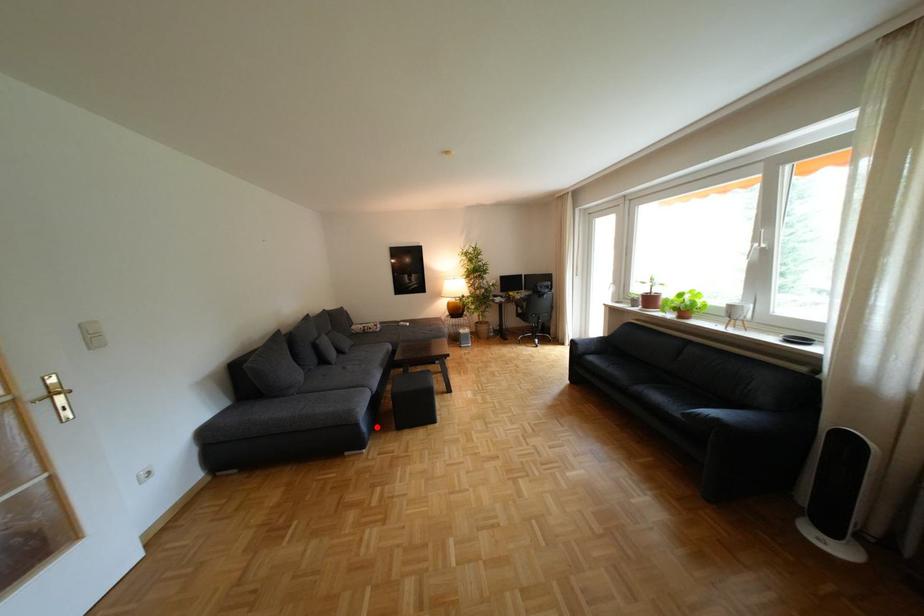
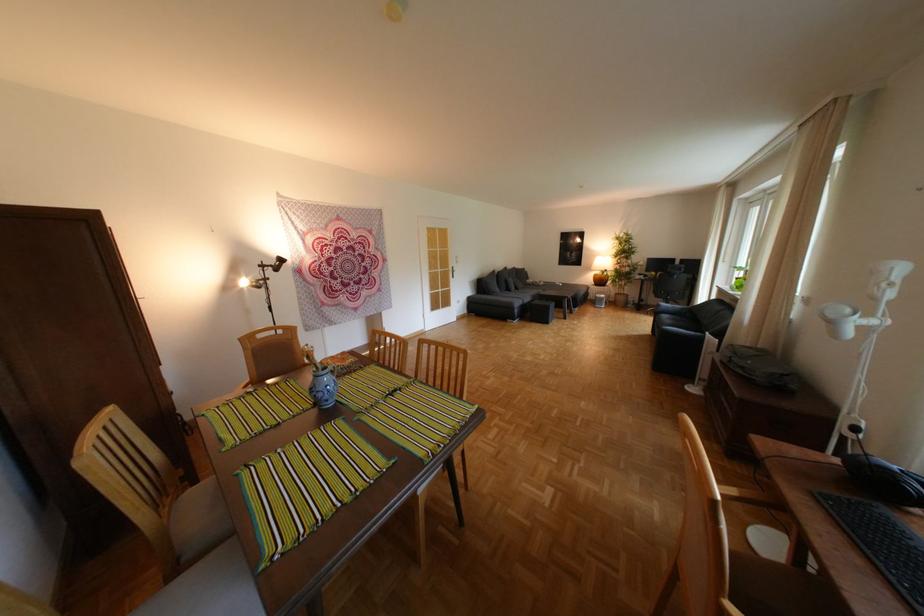
The point at the highlighted location is marked in the first image. Where is the corresponding point in the second image?

(529, 312)